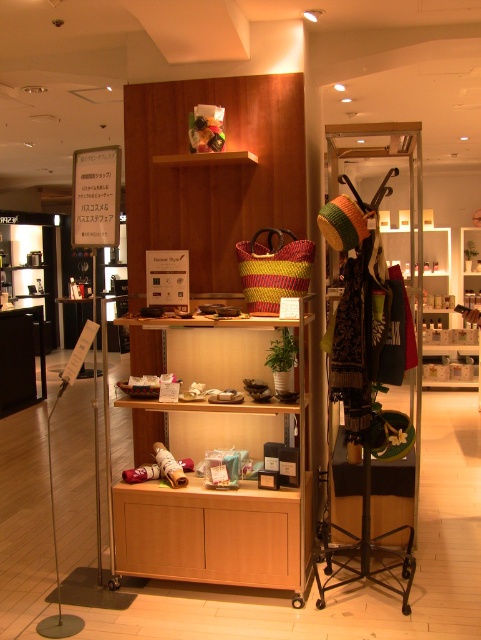
Between wooden shelf at center and yellow-green woven basket at center, which one has less height?

yellow-green woven basket at center is shorter.

Which is in front, point (305, 529) or point (255, 273)?

Point (305, 529) is in front.

Describe the element at coordinates (202, 458) in the screenshot. This screenshot has width=481, height=640. I see `wooden shelf at center` at that location.

You are a GUI agent. You are given a task and a screenshot of the screen. Output one action in this format:
    pyautogui.click(x=<x>, y=<y>)
    Task: Click on the wooden shelf at center
    
    Given the screenshot: What is the action you would take?
    pyautogui.click(x=202, y=458)